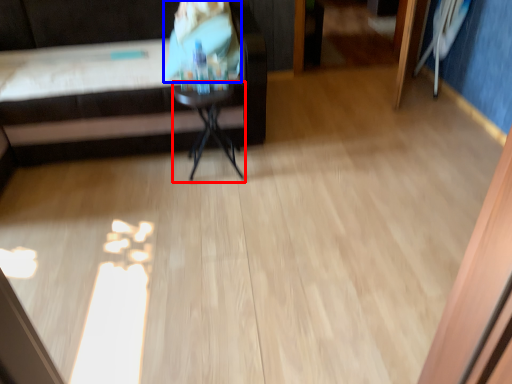
Question: Among these objects, which one is nearest to the camera, side table (highlighted by a red box) or person (highlighted by a blue box)?

Choices:
 (A) side table
 (B) person

Answer: (A)